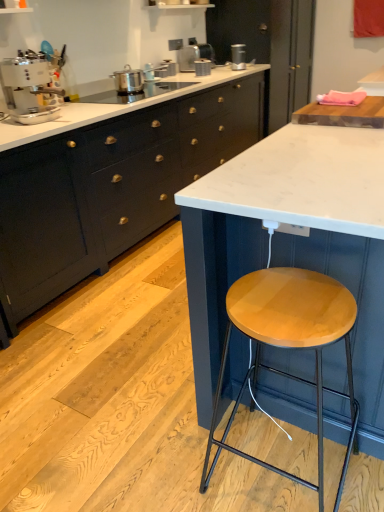
Image resolution: width=384 pixels, height=512 pixels. Find the location of `free spot above wooden cutting board at upper right, which is the 1th countertop in top-to-bottom order (from a real-world perspective)`. free spot above wooden cutting board at upper right, which is the 1th countertop in top-to-bottom order (from a real-world perspective) is located at coordinates (349, 99).